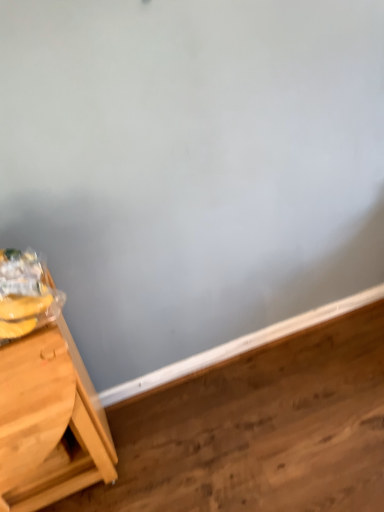
Question: Is light brown wooden table at left far from wooden at lower left?

Choices:
 (A) no
 (B) yes

Answer: (A)

Question: From the image's perspective, does light brown wooden table at left appear lower than wooden at lower left?

Choices:
 (A) yes
 (B) no

Answer: (B)

Question: Is light brown wooden table at left not inside wooden at lower left?

Choices:
 (A) yes
 (B) no

Answer: (A)

Question: Is wooden at lower left inside light brown wooden table at left?

Choices:
 (A) no
 (B) yes

Answer: (A)

Question: Is light brown wooden table at left thinner than wooden at lower left?

Choices:
 (A) yes
 (B) no

Answer: (A)

Question: Is light brown wooden table at left oriented away from wooden at lower left?

Choices:
 (A) yes
 (B) no

Answer: (B)

Question: Can you confirm if wooden at lower left is bigger than light brown wooden table at left?

Choices:
 (A) no
 (B) yes

Answer: (A)

Question: Can you confirm if wooden at lower left is shorter than light brown wooden table at left?

Choices:
 (A) no
 (B) yes

Answer: (B)

Question: Is wooden at lower left oriented away from light brown wooden table at left?

Choices:
 (A) no
 (B) yes

Answer: (A)

Question: Can you confirm if wooden at lower left is smaller than light brown wooden table at left?

Choices:
 (A) no
 (B) yes

Answer: (B)

Question: From the image's perspective, is wooden at lower left under light brown wooden table at left?

Choices:
 (A) yes
 (B) no

Answer: (A)

Question: Is wooden at lower left positioned before light brown wooden table at left?

Choices:
 (A) yes
 (B) no

Answer: (B)

Question: From the image's perspective, is light brown wooden table at left located above or below wooden at lower left?

Choices:
 (A) below
 (B) above

Answer: (B)